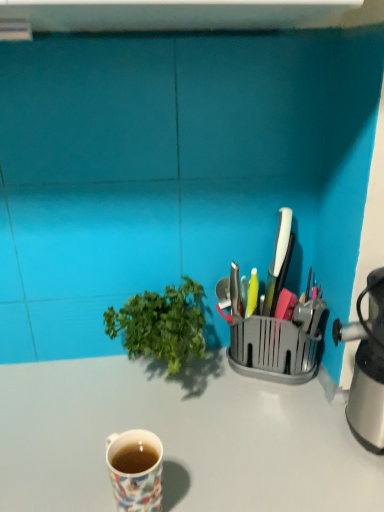
Image resolution: width=384 pixels, height=512 pixels. I want to click on free point behind floral ceramic mug at lower left, so click(x=152, y=415).